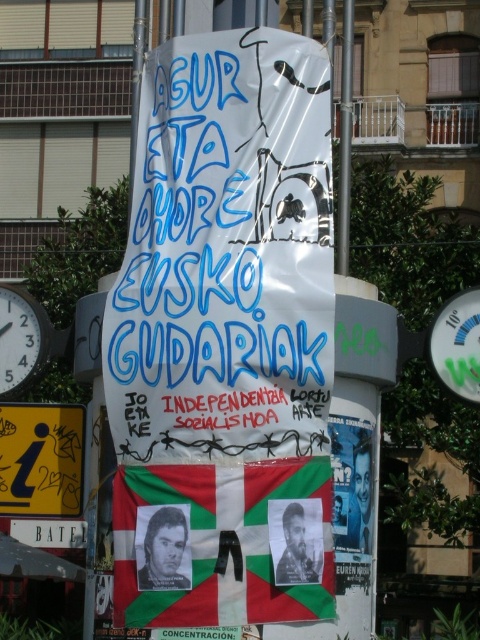
You are standing in front of the large cylindrical structure with the central poster. You need to take a photo of the metallic clock face at left and the camera. How far apart are they?

The metallic clock face at left and camera are 30.92 meters apart.

You are standing in front of the large cylindrical structure and want to locate the white paper poster at center. Can you tell me its exact 2D coordinates?

The white paper poster at center is located at the 2D coordinates of point (x=226, y=256).